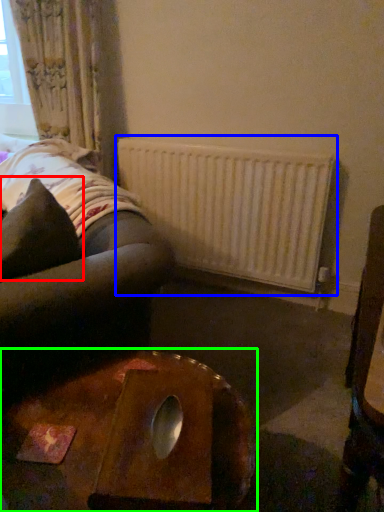
Question: Which object is positioned closest to throw pillow (highlighted by a red box)? Select from radiator (highlighted by a blue box) and table (highlighted by a green box).

Choices:
 (A) radiator
 (B) table

Answer: (B)